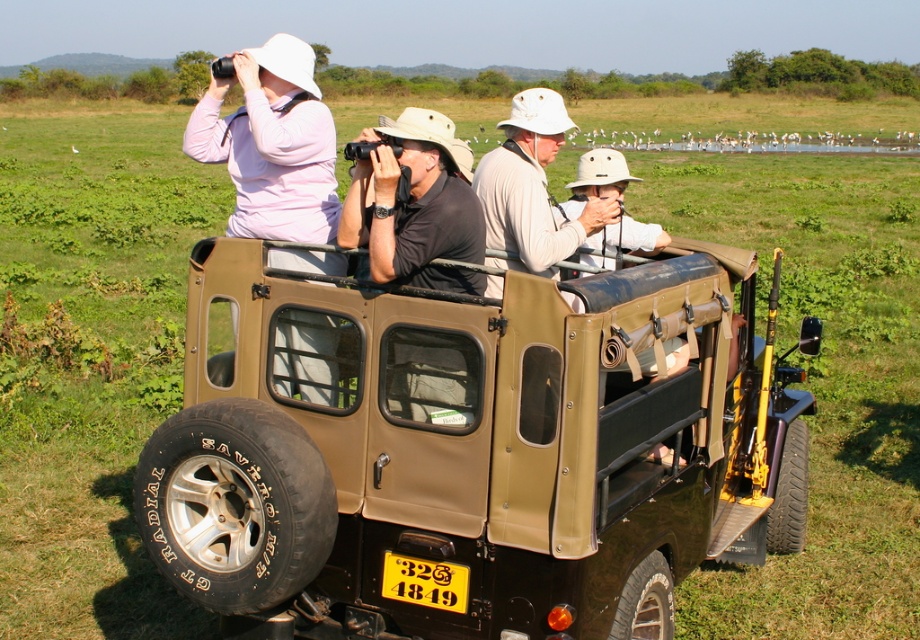
You are a safari guide standing in front of the safari vehicle. You want to hand a map to the tourists inside the matte khaki jeep at center and then show them the license plate number on the yellow matte license plate at rear. Which object should you approach first?

The matte khaki jeep at center is closer to the viewer than the yellow matte license plate at rear, so you should first hand the map to the tourists inside the matte khaki jeep at center before showing them the license plate number on the yellow matte license plate at rear.

You are standing at the origin point of the coordinate system, which is the bottom left corner of the image. You see a point at coordinate point (467, 448). What object is located at that coordinate?

The point at coordinate (467, 448) is occupied by the matte khaki jeep at center.